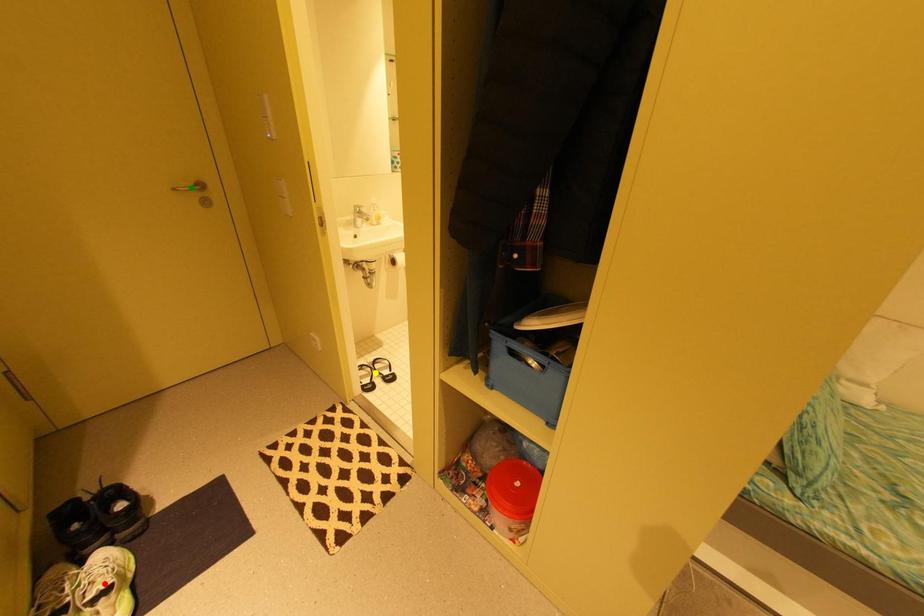
Order these from nearest to farthest:
red point | green point | yellow point

yellow point, green point, red point